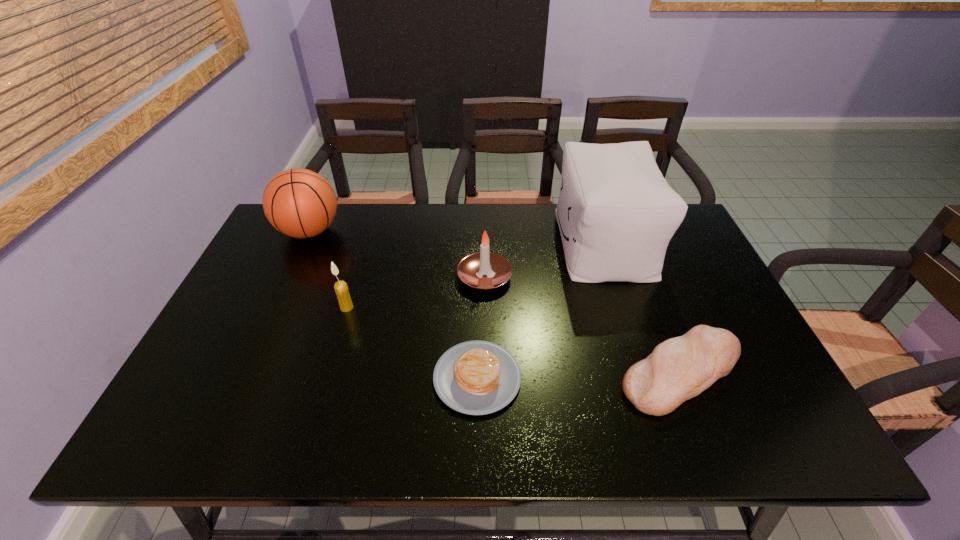
Locate an element on the screen. The height and width of the screenshot is (540, 960). free space at the far right corner of the desktop is located at coordinates (682, 248).

The width and height of the screenshot is (960, 540). Find the location of `vacant area that lies between the right candle and the basketball`. vacant area that lies between the right candle and the basketball is located at coordinates pos(397,254).

The height and width of the screenshot is (540, 960). Identify the location of vacant space that's between the leftmost object and the cushion. (457, 237).

Find the location of a particular element. empty space between the shortest object and the cushion is located at coordinates (540, 310).

At what (x,y) coordinates should I click in order to perform the action: click on unoccupied area between the basketball and the farther candle. Please return your answer as a coordinate pair (x, y). Image resolution: width=960 pixels, height=540 pixels. Looking at the image, I should click on (397, 254).

Where is `free space between the shortest object and the right candle`? free space between the shortest object and the right candle is located at coordinates (481, 327).

Where is `vacant area that lies between the tallest object and the basketball`? vacant area that lies between the tallest object and the basketball is located at coordinates (457, 237).

Where is `vacant area that lies between the tallest object and the farther candle`? vacant area that lies between the tallest object and the farther candle is located at coordinates (544, 260).

This screenshot has width=960, height=540. What are the coordinates of `vacant region between the shortest object and the second tallest object` in the screenshot? It's located at pyautogui.click(x=394, y=305).

I want to click on free space between the cushion and the fifth tallest object, so click(x=643, y=308).